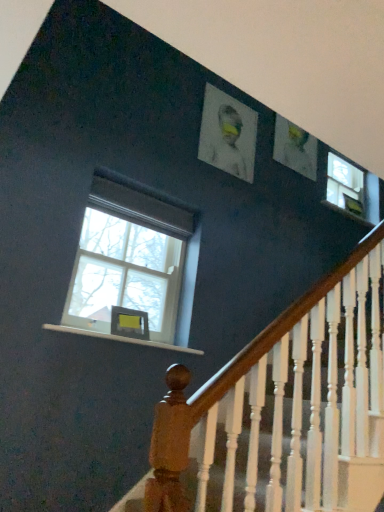
Question: Considering the relative sizes of clear glass window at left and white matte portrait at upper center in the image provided, is clear glass window at left taller than white matte portrait at upper center?

Choices:
 (A) no
 (B) yes

Answer: (B)

Question: Is white matte portrait at upper center surrounded by clear glass window at left?

Choices:
 (A) yes
 (B) no

Answer: (B)

Question: From the image's perspective, is clear glass window at left below white matte portrait at upper center?

Choices:
 (A) yes
 (B) no

Answer: (A)

Question: Is clear glass window at left bigger than white matte portrait at upper center?

Choices:
 (A) no
 (B) yes

Answer: (B)

Question: Is clear glass window at left directly adjacent to white matte portrait at upper center?

Choices:
 (A) yes
 (B) no

Answer: (B)

Question: Does clear glass window at left lie in front of white matte portrait at upper center?

Choices:
 (A) yes
 (B) no

Answer: (A)

Question: Can you confirm if clear glass window at left is taller than white wood at lower left?

Choices:
 (A) yes
 (B) no

Answer: (A)

Question: Could you tell me if clear glass window at left is turned towards white wood at lower left?

Choices:
 (A) yes
 (B) no

Answer: (B)

Question: Is the depth of clear glass window at left greater than that of white wood at lower left?

Choices:
 (A) yes
 (B) no

Answer: (A)

Question: From a real-world perspective, is clear glass window at left below white wood at lower left?

Choices:
 (A) yes
 (B) no

Answer: (B)

Question: Is clear glass window at left shorter than white wood at lower left?

Choices:
 (A) no
 (B) yes

Answer: (A)

Question: Does clear glass window at left have a larger size compared to white wood at lower left?

Choices:
 (A) no
 (B) yes

Answer: (B)

Question: Can you confirm if white matte portrait at upper center is positioned to the left of white wood at lower left?

Choices:
 (A) yes
 (B) no

Answer: (B)